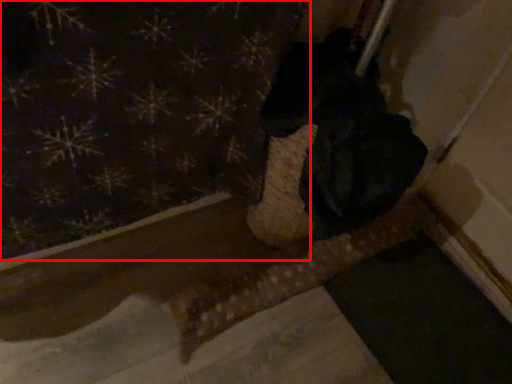
Question: From the image's perspective, where is curtain (annotated by the red box) located relative to animal?

Choices:
 (A) above
 (B) below

Answer: (A)